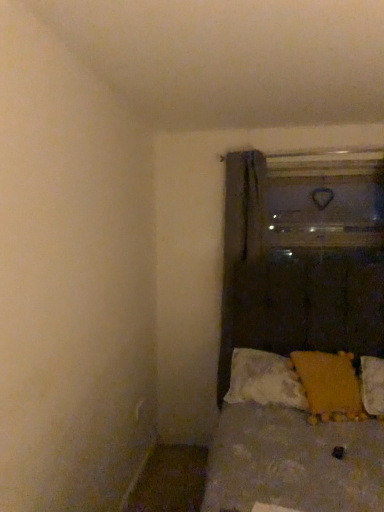
The image size is (384, 512). I want to click on white textured pillow at lower right, the 2th pillow from the right, so click(264, 380).

This screenshot has height=512, width=384. What do you see at coordinates (324, 200) in the screenshot? I see `transparent glass door at upper right` at bounding box center [324, 200].

Where is `white textured pillow at lower right, the first pillow positioned from the left`? white textured pillow at lower right, the first pillow positioned from the left is located at coordinates tap(264, 380).

Does dark gray fabric curtain at center come in front of yellow fabric pillow at lower right, placed as the second pillow when sorted from left to right?

That is False.

Considering the sizes of dark gray fabric curtain at center and yellow fabric pillow at lower right, placed as the second pillow when sorted from left to right, in the image, is dark gray fabric curtain at center bigger or smaller than yellow fabric pillow at lower right, placed as the second pillow when sorted from left to right,?

In the image, dark gray fabric curtain at center appears to be larger than yellow fabric pillow at lower right, placed as the second pillow when sorted from left to right.

Is point (262, 239) farther from camera compared to point (308, 399)?

That is True.

From the image's perspective, which is above, dark gray fabric curtain at center or transparent glass door at upper right?

transparent glass door at upper right.

Looking at this image, between dark gray fabric curtain at center and transparent glass door at upper right, which one has smaller width?

transparent glass door at upper right.

Would you say transparent glass door at upper right is part of dark gray fabric curtain at center's contents?

No.

You are a GUI agent. You are given a task and a screenshot of the screen. Output one action in this format:
    pyautogui.click(x=<x>, y=<y>)
    Task: Click on the glass door located on the right of dark gray fabric curtain at center
    The width and height of the screenshot is (384, 512).
    Given the screenshot: What is the action you would take?
    pyautogui.click(x=324, y=200)

Between white textured pillow at lower right, the first pillow positioned from the left, and yellow fabric pillow at lower right, the first pillow viewed from the right, which one appears on the right side from the viewer's perspective?

From the viewer's perspective, yellow fabric pillow at lower right, the first pillow viewed from the right, appears more on the right side.

Looking at the image, does white textured pillow at lower right, the 2th pillow from the right, seem bigger or smaller compared to yellow fabric pillow at lower right, the first pillow viewed from the right?

Considering their sizes, white textured pillow at lower right, the 2th pillow from the right, takes up more space than yellow fabric pillow at lower right, the first pillow viewed from the right.

From a real-world perspective, between white textured pillow at lower right, the 2th pillow from the right, and yellow fabric pillow at lower right, placed as the second pillow when sorted from left to right, who is vertically lower?

white textured pillow at lower right, the 2th pillow from the right.

How different are the orientations of white textured pillow at lower right, the first pillow positioned from the left, and yellow fabric pillow at lower right, the first pillow viewed from the right, in degrees?

17.5 degrees separate the facing orientations of white textured pillow at lower right, the first pillow positioned from the left, and yellow fabric pillow at lower right, the first pillow viewed from the right.

Who is smaller, yellow fabric pillow at lower right, placed as the second pillow when sorted from left to right, or dark gray fabric curtain at center?

Smaller between the two is yellow fabric pillow at lower right, placed as the second pillow when sorted from left to right.

Is yellow fabric pillow at lower right, placed as the second pillow when sorted from left to right, wider or thinner than dark gray fabric curtain at center?

Considering their sizes, yellow fabric pillow at lower right, placed as the second pillow when sorted from left to right, looks broader than dark gray fabric curtain at center.

Can you tell me how much yellow fabric pillow at lower right, the first pillow viewed from the right, and dark gray fabric curtain at center differ in facing direction?

15.5 degrees.

Is there a large distance between yellow fabric pillow at lower right, the first pillow viewed from the right, and dark gray fabric curtain at center?

No, there isn't a large distance between yellow fabric pillow at lower right, the first pillow viewed from the right, and dark gray fabric curtain at center.

Is yellow fabric pillow at lower right, placed as the second pillow when sorted from left to right, not close to transparent glass door at upper right?

Yes, yellow fabric pillow at lower right, placed as the second pillow when sorted from left to right, and transparent glass door at upper right are located far from each other.

Is yellow fabric pillow at lower right, the first pillow viewed from the right, shorter than transparent glass door at upper right?

Yes, yellow fabric pillow at lower right, the first pillow viewed from the right, is shorter than transparent glass door at upper right.

How different are the orientations of yellow fabric pillow at lower right, placed as the second pillow when sorted from left to right, and transparent glass door at upper right in degrees?

16.5 degrees separate the facing orientations of yellow fabric pillow at lower right, placed as the second pillow when sorted from left to right, and transparent glass door at upper right.

Which of these two, yellow fabric pillow at lower right, the first pillow viewed from the right, or transparent glass door at upper right, is wider?

yellow fabric pillow at lower right, the first pillow viewed from the right.

Considering the sizes of objects yellow fabric pillow at lower right, the first pillow viewed from the right, and white textured pillow at lower right, the 2th pillow from the right, in the image provided, who is wider, yellow fabric pillow at lower right, the first pillow viewed from the right, or white textured pillow at lower right, the 2th pillow from the right,?

yellow fabric pillow at lower right, the first pillow viewed from the right.

Is yellow fabric pillow at lower right, placed as the second pillow when sorted from left to right, aimed at white textured pillow at lower right, the first pillow positioned from the left?

Yes.

Which of these two, yellow fabric pillow at lower right, placed as the second pillow when sorted from left to right, or white textured pillow at lower right, the 2th pillow from the right, stands taller?

With more height is yellow fabric pillow at lower right, placed as the second pillow when sorted from left to right.

Does transparent glass door at upper right have a lesser height compared to white textured pillow at lower right, the 2th pillow from the right?

Incorrect, the height of transparent glass door at upper right does not fall short of that of white textured pillow at lower right, the 2th pillow from the right.

Is transparent glass door at upper right aimed at white textured pillow at lower right, the 2th pillow from the right?

No, transparent glass door at upper right is not facing towards white textured pillow at lower right, the 2th pillow from the right.

Considering the relative positions of transparent glass door at upper right and white textured pillow at lower right, the first pillow positioned from the left, in the image provided, is transparent glass door at upper right behind white textured pillow at lower right, the first pillow positioned from the left,?

Yes.

Does transparent glass door at upper right appear on the right side of white textured pillow at lower right, the 2th pillow from the right?

Indeed, transparent glass door at upper right is positioned on the right side of white textured pillow at lower right, the 2th pillow from the right.

From the image's perspective, starting from the dark gray fabric curtain at center, which pillow is the 1st one below? Please provide its 2D coordinates.

[(329, 385)]

I want to click on glass door above the dark gray fabric curtain at center (from a real-world perspective), so click(x=324, y=200).

When comparing their distances from transparent glass door at upper right, does white textured pillow at lower right, the first pillow positioned from the left, or yellow fabric pillow at lower right, placed as the second pillow when sorted from left to right, seem closer?

Among the two, yellow fabric pillow at lower right, placed as the second pillow when sorted from left to right, is located nearer to transparent glass door at upper right.

Considering their positions, is yellow fabric pillow at lower right, placed as the second pillow when sorted from left to right, positioned further to transparent glass door at upper right than white textured pillow at lower right, the 2th pillow from the right?

white textured pillow at lower right, the 2th pillow from the right, is positioned further to the anchor transparent glass door at upper right.

From the image, which object appears to be farther from transparent glass door at upper right, white textured pillow at lower right, the 2th pillow from the right, or dark gray fabric curtain at center?

white textured pillow at lower right, the 2th pillow from the right, lies further to transparent glass door at upper right than the other object.

Based on their spatial positions, is yellow fabric pillow at lower right, the first pillow viewed from the right, or white textured pillow at lower right, the 2th pillow from the right, further from dark gray fabric curtain at center?

yellow fabric pillow at lower right, the first pillow viewed from the right, is further to dark gray fabric curtain at center.

Based on their spatial positions, is dark gray fabric curtain at center or transparent glass door at upper right closer to white textured pillow at lower right, the 2th pillow from the right?

dark gray fabric curtain at center lies closer to white textured pillow at lower right, the 2th pillow from the right, than the other object.

Looking at the image, which one is located closer to white textured pillow at lower right, the first pillow positioned from the left, dark gray fabric curtain at center or yellow fabric pillow at lower right, the first pillow viewed from the right?

yellow fabric pillow at lower right, the first pillow viewed from the right, lies closer to white textured pillow at lower right, the first pillow positioned from the left, than the other object.

From the picture: Considering their positions, is transparent glass door at upper right positioned further to yellow fabric pillow at lower right, the first pillow viewed from the right, than white textured pillow at lower right, the first pillow positioned from the left?

The object further to yellow fabric pillow at lower right, the first pillow viewed from the right, is transparent glass door at upper right.

Estimate the real-world distances between objects in this image. Which object is closer to transparent glass door at upper right, yellow fabric pillow at lower right, placed as the second pillow when sorted from left to right, or dark gray fabric curtain at center?

dark gray fabric curtain at center.

Where is `pillow between transparent glass door at upper right and white textured pillow at lower right, the 2th pillow from the right, vertically`? The image size is (384, 512). pillow between transparent glass door at upper right and white textured pillow at lower right, the 2th pillow from the right, vertically is located at coordinates (329, 385).

This screenshot has width=384, height=512. What are the coordinates of `pillow located between yellow fabric pillow at lower right, the first pillow viewed from the right, and dark gray fabric curtain at center in the depth direction` in the screenshot? It's located at (264, 380).

The width and height of the screenshot is (384, 512). In order to click on curtain between transparent glass door at upper right and white textured pillow at lower right, the 2th pillow from the right, from top to bottom in this screenshot , I will do `click(243, 261)`.

Image resolution: width=384 pixels, height=512 pixels. In order to click on curtain between transparent glass door at upper right and yellow fabric pillow at lower right, the first pillow viewed from the right, in the vertical direction in this screenshot , I will do `click(243, 261)`.